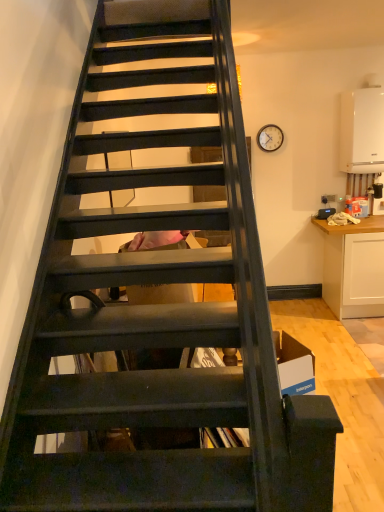
Question: From the image's perspective, is white matte cabinet at right on white matte boiler at upper right?

Choices:
 (A) yes
 (B) no

Answer: (B)

Question: Is white matte boiler at upper right a part of white matte cabinet at right?

Choices:
 (A) no
 (B) yes

Answer: (A)

Question: Considering the relative sizes of white matte cabinet at right and white matte boiler at upper right in the image provided, is white matte cabinet at right bigger than white matte boiler at upper right?

Choices:
 (A) no
 (B) yes

Answer: (B)

Question: Considering the relative sizes of white matte cabinet at right and white matte boiler at upper right in the image provided, is white matte cabinet at right thinner than white matte boiler at upper right?

Choices:
 (A) no
 (B) yes

Answer: (A)

Question: Does white matte cabinet at right have a greater width compared to white matte boiler at upper right?

Choices:
 (A) no
 (B) yes

Answer: (B)

Question: Is white matte cabinet at right positioned with its back to white matte boiler at upper right?

Choices:
 (A) yes
 (B) no

Answer: (B)

Question: From a real-world perspective, is matte brown clock at upper right below white matte boiler at upper right?

Choices:
 (A) no
 (B) yes

Answer: (A)

Question: Is matte brown clock at upper right facing towards white matte boiler at upper right?

Choices:
 (A) yes
 (B) no

Answer: (B)

Question: Is matte brown clock at upper right positioned before white matte boiler at upper right?

Choices:
 (A) no
 (B) yes

Answer: (A)

Question: Can you confirm if matte brown clock at upper right is wider than white matte boiler at upper right?

Choices:
 (A) yes
 (B) no

Answer: (B)

Question: Considering the relative sizes of matte brown clock at upper right and white matte boiler at upper right in the image provided, is matte brown clock at upper right shorter than white matte boiler at upper right?

Choices:
 (A) yes
 (B) no

Answer: (A)

Question: Is matte brown clock at upper right beside white matte boiler at upper right?

Choices:
 (A) yes
 (B) no

Answer: (B)

Question: Is white matte boiler at upper right aimed at matte brown clock at upper right?

Choices:
 (A) no
 (B) yes

Answer: (A)